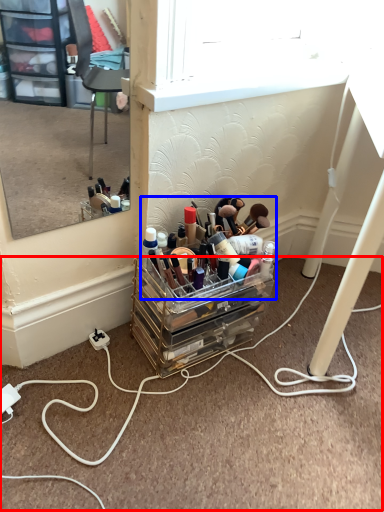
Question: Which of the following is the farthest to the observer, cable (highlighted by a red box) or toiletry (highlighted by a blue box)?

Choices:
 (A) cable
 (B) toiletry

Answer: (B)